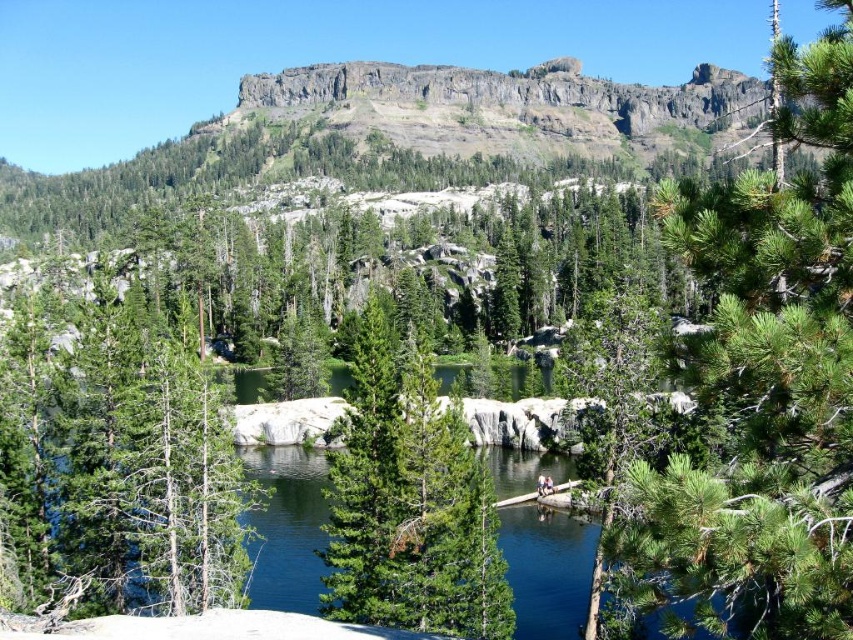
Is clear blue water at center wider than green matte tree at center?

Yes.

Identify the location of clear blue water at center. (288, 528).

Who is more distant from viewer, [297,541] or [657,332]?

Positioned behind is point [297,541].

I want to click on clear blue water at center, so click(288, 528).

Which is more to the left, green needle-like tree at center-right or clear blue water at center?

From the viewer's perspective, clear blue water at center appears more on the left side.

The width and height of the screenshot is (853, 640). Describe the element at coordinates (764, 385) in the screenshot. I see `green needle-like tree at center-right` at that location.

Does point (827, 268) lie behind point (521, 484)?

That is False.

At what (x,y) coordinates should I click in order to perform the action: click on green needle-like tree at center-right. Please return your answer as a coordinate pair (x, y). Looking at the image, I should click on (764, 385).

Who is more distant from viewer, (335, 609) or (657, 308)?

Point (657, 308)

In order to click on green needle-like tree at center in this screenshot , I will do `click(410, 502)`.